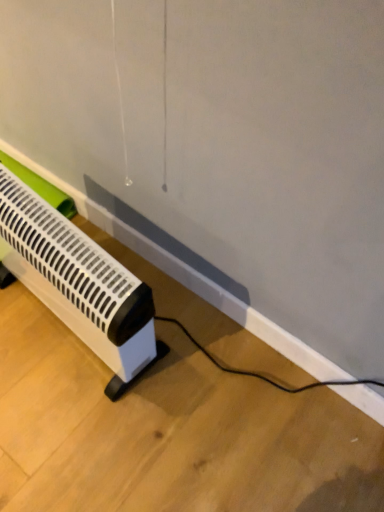
What do you see at coordinates (79, 283) in the screenshot?
I see `white plastic heater at lower left` at bounding box center [79, 283].

Image resolution: width=384 pixels, height=512 pixels. In order to click on white plastic heater at lower left in this screenshot , I will do `click(79, 283)`.

Find the location of `white plastic heater at lower left`. white plastic heater at lower left is located at coordinates (79, 283).